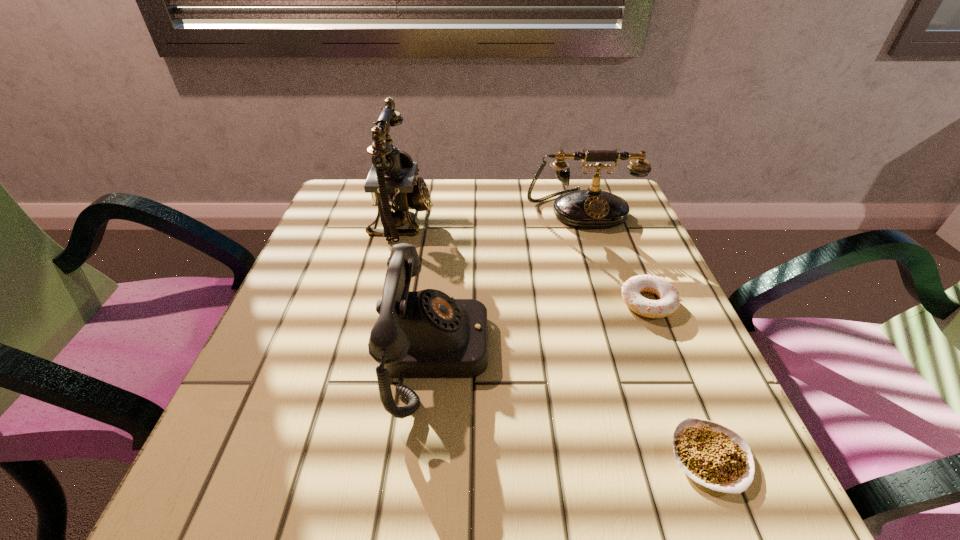
I want to click on free location at the left edge of the desktop, so click(276, 401).

You are a GUI agent. You are given a task and a screenshot of the screen. Output one action in this format:
    pyautogui.click(x=<x>, y=<y>)
    Task: Click on the free space at the right edge of the desktop
    This screenshot has width=960, height=540.
    Given the screenshot: What is the action you would take?
    pyautogui.click(x=610, y=293)

Locate an element on the screen. vacant area at the near left corner is located at coordinates (298, 494).

Where is `vacant space at the near right corner of the desktop`? vacant space at the near right corner of the desktop is located at coordinates (724, 496).

The height and width of the screenshot is (540, 960). What are the coordinates of `vacant space that's between the nearest telephone and the rightmost telephone` in the screenshot? It's located at (508, 281).

The image size is (960, 540). What are the coordinates of `free space that is in between the rightmost telephone and the nearest telephone` in the screenshot? It's located at (508, 281).

Where is `unoccupied position between the second shortest object and the shortest object`? The width and height of the screenshot is (960, 540). unoccupied position between the second shortest object and the shortest object is located at coordinates (679, 380).

Image resolution: width=960 pixels, height=540 pixels. I want to click on unoccupied position between the rightmost telephone and the legume, so click(x=645, y=333).

Identify the location of free spot between the tallest telephone and the doughnut. (525, 261).

Locate an element on the screen. vacant area between the tallest telephone and the nearest telephone is located at coordinates (419, 286).